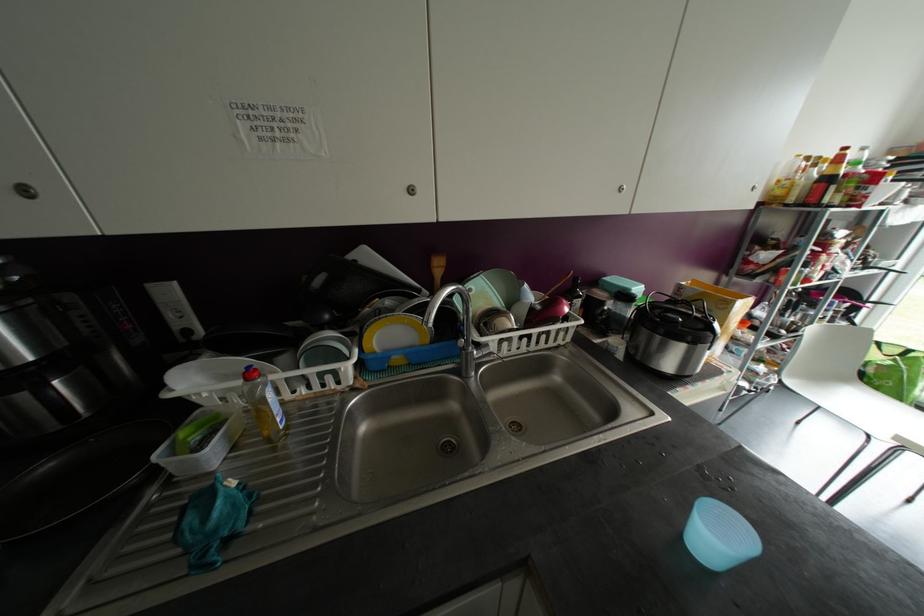
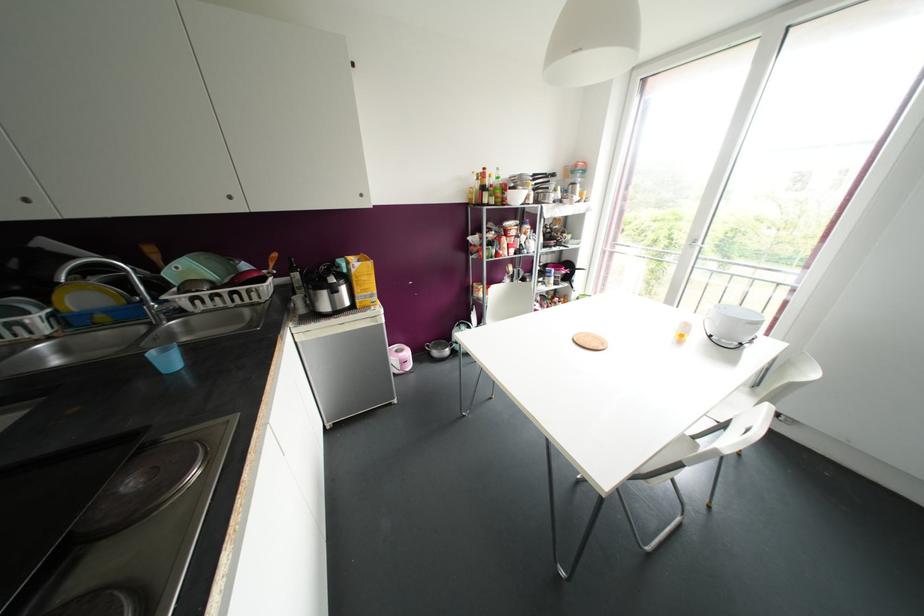
The point at (396, 359) is marked in the first image. Where is the corresponding point in the second image?

(101, 317)